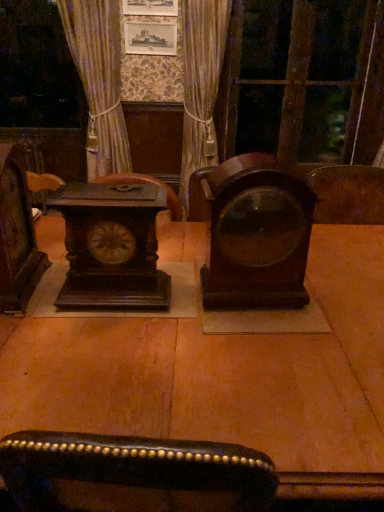
Question: Based on their sizes in the image, would you say mahogany wood alarm clock at center, which is counted as the 1th alarm clock, starting from the right, is bigger or smaller than dark wood clock at left?

Choices:
 (A) small
 (B) big

Answer: (A)

Question: Is mahogany wood alarm clock at center, the 2th alarm clock positioned from the left, to the left or to the right of dark wood clock at left in the image?

Choices:
 (A) left
 (B) right

Answer: (B)

Question: Which is nearer to the mahogany wood alarm clock at center, which is counted as the 1th alarm clock, starting from the right?

Choices:
 (A) dark brown wood clock at left, the 2th alarm clock in the right-to-left sequence
 (B) dark wood clock at left
 (C) velvet gold curtain at center
 (D) transparent glass door at upper right
 (E) dark wood table at center

Answer: (A)

Question: Which object is the farthest from the velvet gold curtain at center?

Choices:
 (A) transparent glass door at upper right
 (B) dark wood table at center
 (C) dark brown wood clock at left, positioned as the 1th alarm clock in left-to-right order
 (D) mahogany wood alarm clock at center, which is counted as the 1th alarm clock, starting from the right
 (E) dark wood clock at left

Answer: (B)